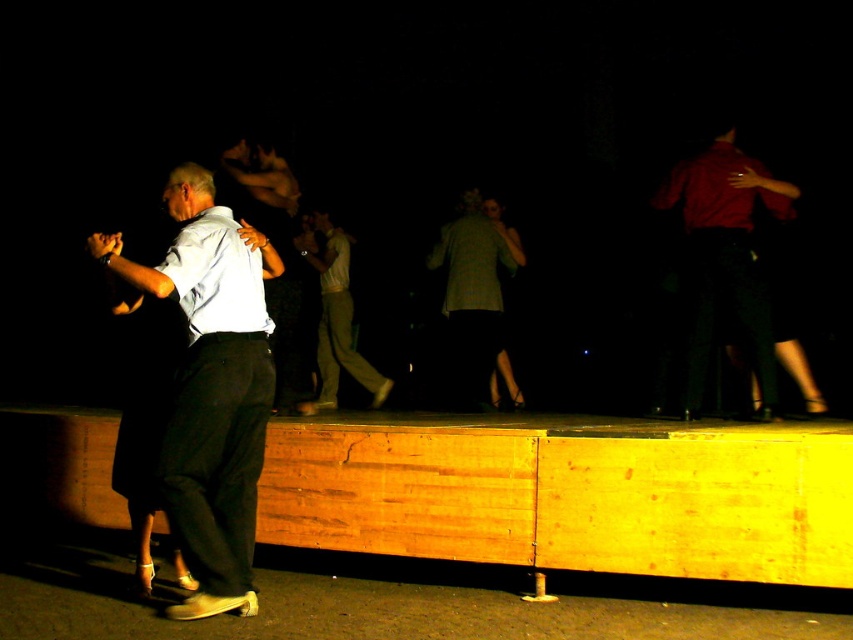
You are a photographer at the event and want to capture a photo that includes both the matte red shirt at upper right and the green plaid shirt at center. Based on their positions, which one should you focus on first to ensure both are in frame?

The matte red shirt at upper right is located above the green plaid shirt at center, so you should focus on the green plaid shirt at center first to ensure both are in frame.

Consider the image. You are standing on the wooden stage and want to move from the point at coordinates point (234, 492) to the point at coordinates point (495, 228). Which direction should you move to reach your destination?

You should move backward to reach the point at coordinates point (495, 228) because point (234, 492) is in front of it.